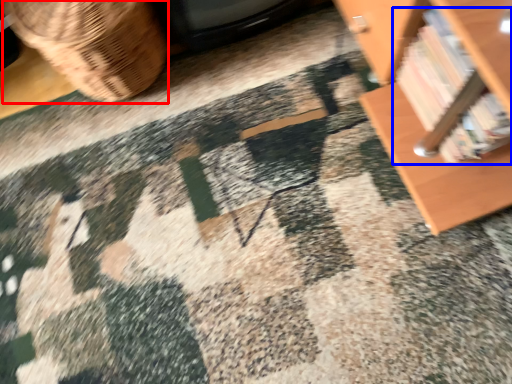
Question: Which of the following is the closest to the observer, basket (highlighted by a red box) or book (highlighted by a blue box)?

Choices:
 (A) basket
 (B) book

Answer: (B)